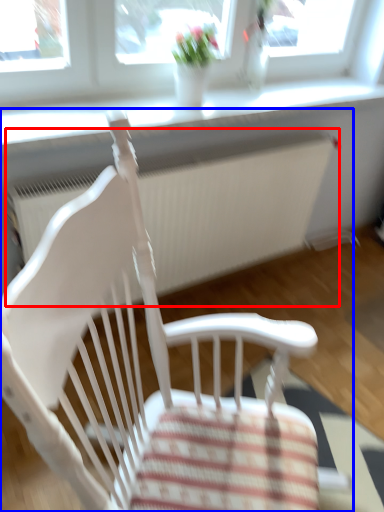
Question: Among these objects, which one is farthest to the camera, radiator (highlighted by a red box) or chair (highlighted by a blue box)?

Choices:
 (A) radiator
 (B) chair

Answer: (A)